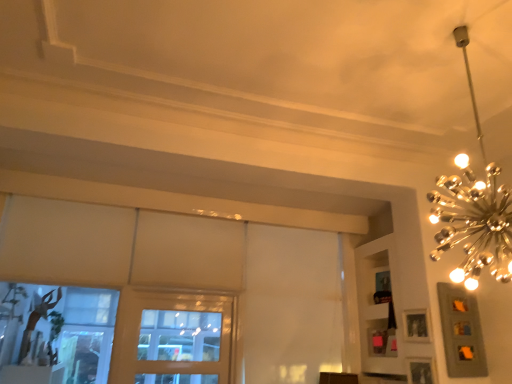
Question: From the image's perspective, does gold metallic chandelier at upper right appear lower than wooden picture frame at lower right, marked as the 2th picture frame in a top-to-bottom arrangement?

Choices:
 (A) no
 (B) yes

Answer: (A)

Question: Is gold metallic chandelier at upper right at the left side of wooden picture frame at lower right, the first picture frame ordered from the bottom?

Choices:
 (A) no
 (B) yes

Answer: (B)

Question: Does gold metallic chandelier at upper right have a lesser width compared to wooden picture frame at lower right, marked as the 2th picture frame in a top-to-bottom arrangement?

Choices:
 (A) yes
 (B) no

Answer: (B)

Question: Considering the relative sizes of gold metallic chandelier at upper right and wooden picture frame at lower right, marked as the 2th picture frame in a top-to-bottom arrangement, in the image provided, is gold metallic chandelier at upper right taller than wooden picture frame at lower right, marked as the 2th picture frame in a top-to-bottom arrangement,?

Choices:
 (A) no
 (B) yes

Answer: (B)

Question: Would you say gold metallic chandelier at upper right contains wooden picture frame at lower right, the first picture frame ordered from the bottom?

Choices:
 (A) yes
 (B) no

Answer: (B)

Question: Considering the positions of wooden window at center and matte silver picture frame at upper right, the first picture frame positioned from the top, in the image, is wooden window at center bigger or smaller than matte silver picture frame at upper right, the first picture frame positioned from the top,?

Choices:
 (A) small
 (B) big

Answer: (B)

Question: From a real-world perspective, is wooden window at center physically located above or below matte silver picture frame at upper right, the first picture frame positioned from the top?

Choices:
 (A) below
 (B) above

Answer: (A)

Question: Considering the positions of wooden window at center and matte silver picture frame at upper right, which ranks as the 2th picture frame in bottom-to-top order, in the image, is wooden window at center taller or shorter than matte silver picture frame at upper right, which ranks as the 2th picture frame in bottom-to-top order,?

Choices:
 (A) short
 (B) tall

Answer: (B)

Question: Relative to matte silver picture frame at upper right, the first picture frame positioned from the top, is wooden window at center in front or behind?

Choices:
 (A) front
 (B) behind

Answer: (B)

Question: Is white matte shelf at upper right to the left or to the right of gold metallic chandelier at upper right in the image?

Choices:
 (A) right
 (B) left

Answer: (A)

Question: From a real-world perspective, is white matte shelf at upper right physically located above or below gold metallic chandelier at upper right?

Choices:
 (A) above
 (B) below

Answer: (B)

Question: Would you say white matte shelf at upper right is inside or outside gold metallic chandelier at upper right?

Choices:
 (A) outside
 (B) inside

Answer: (A)

Question: From the image's perspective, is white matte shelf at upper right positioned above or below gold metallic chandelier at upper right?

Choices:
 (A) above
 (B) below

Answer: (B)

Question: Considering the positions of point [x=416, y=336] and point [x=496, y=221], is point [x=416, y=336] closer or farther from the camera than point [x=496, y=221]?

Choices:
 (A) farther
 (B) closer

Answer: (A)

Question: From the image's perspective, relative to gold metallic chandelier at upper right, is matte silver picture frame at upper right, the first picture frame positioned from the top, above or below?

Choices:
 (A) below
 (B) above

Answer: (A)